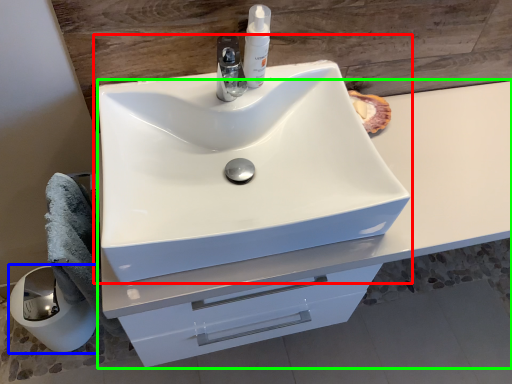
Question: Which is nearer to the sink (highlighted by a red box)? paper towel (highlighted by a blue box) or bathroom cabinet (highlighted by a green box).

Choices:
 (A) paper towel
 (B) bathroom cabinet

Answer: (B)